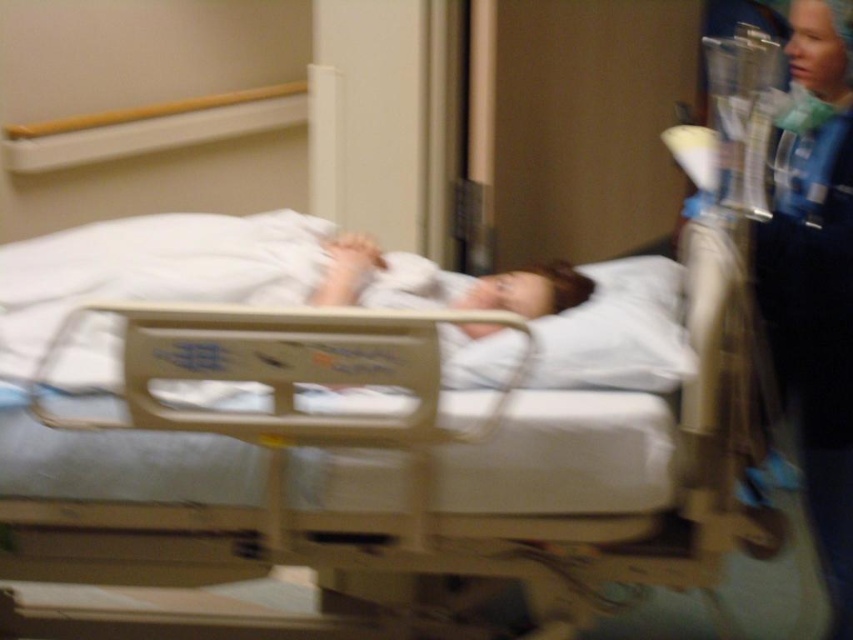
Which is behind, point (636, 579) or point (845, 422)?

The point (845, 422) is behind.

Who is taller, beige plastic hospital bed at center or blue scrubs at right?

Standing taller between the two is blue scrubs at right.

Image resolution: width=853 pixels, height=640 pixels. Describe the element at coordinates (370, 458) in the screenshot. I see `beige plastic hospital bed at center` at that location.

I want to click on beige plastic hospital bed at center, so tap(370, 458).